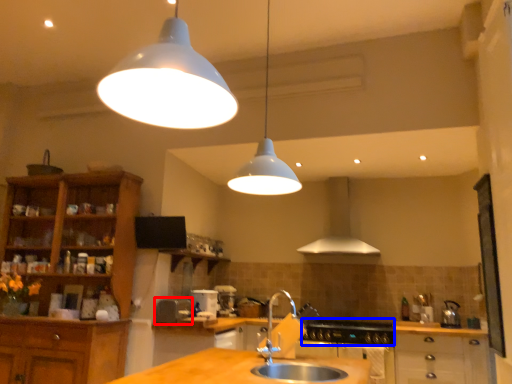
Question: Which object is closer to the camera taking this photo, appliance (highlighted by a red box) or gas stove (highlighted by a blue box)?

Choices:
 (A) appliance
 (B) gas stove

Answer: (A)